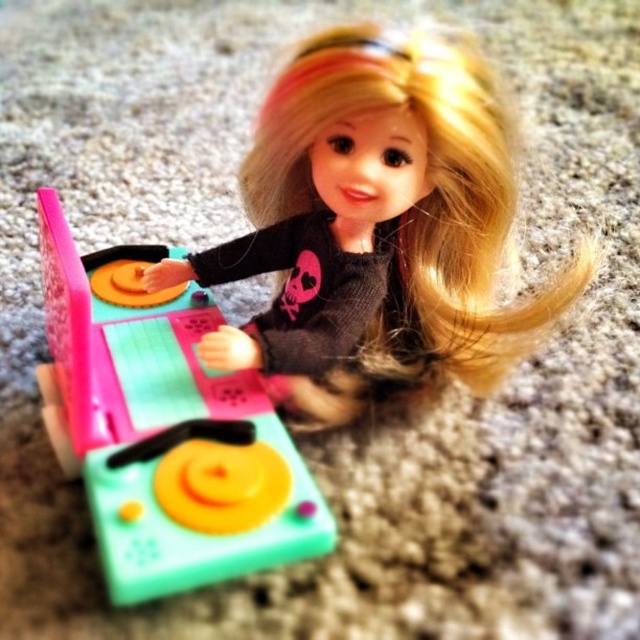
Question: Which object appears farthest from the camera in this image?

Choices:
 (A) matte plastic turntable at center
 (B) black matte doll at center

Answer: (B)

Question: Which point is closer to the camera?

Choices:
 (A) (138, 508)
 (B) (278, 160)

Answer: (A)

Question: Is black matte doll at center above matte plastic turntable at center?

Choices:
 (A) yes
 (B) no

Answer: (A)

Question: Does black matte doll at center appear on the right side of matte plastic turntable at center?

Choices:
 (A) yes
 (B) no

Answer: (A)

Question: Does black matte doll at center appear on the left side of matte plastic turntable at center?

Choices:
 (A) no
 (B) yes

Answer: (A)